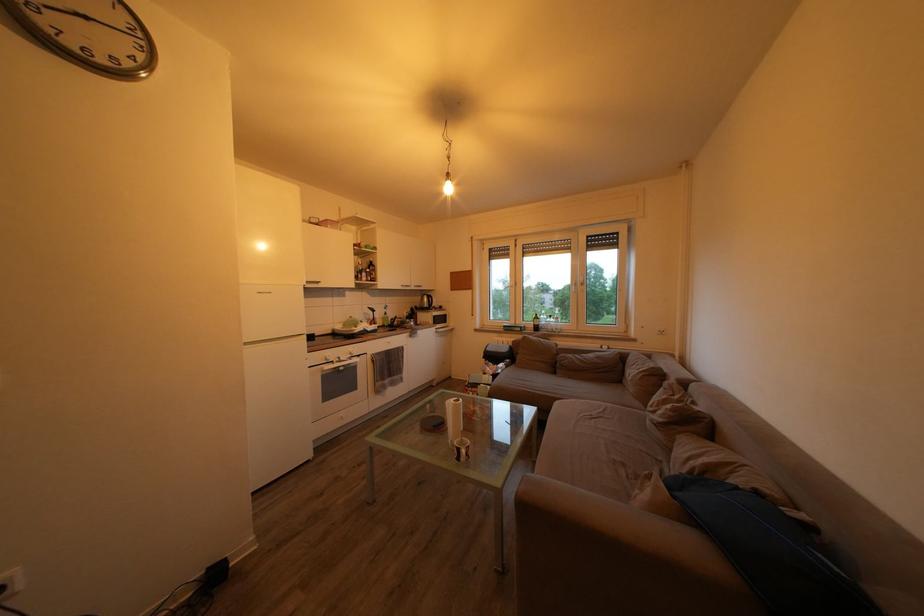
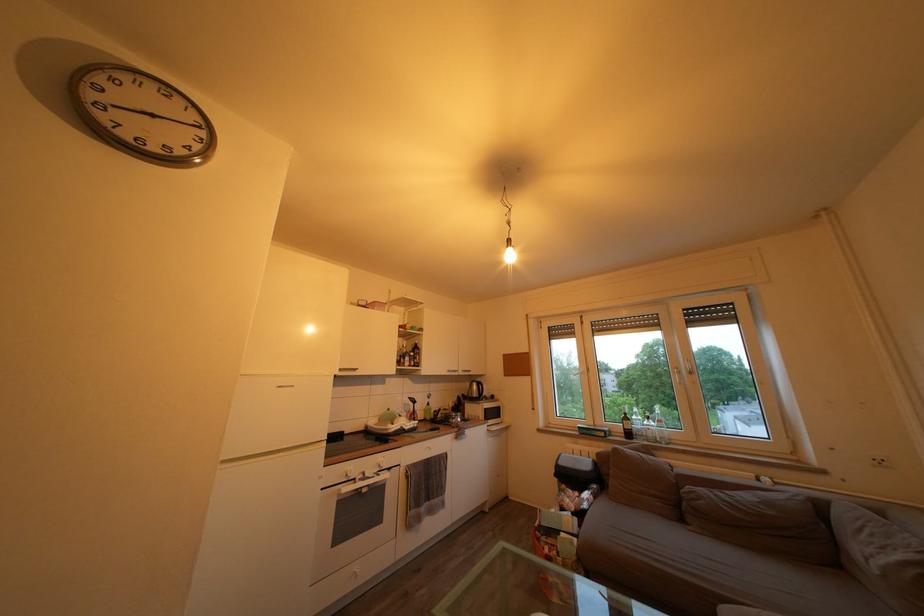
Question: I am providing you with two images of the same scene from different viewpoints. After the viewpoint changes to image2, which objects are now occluded?

Choices:
 (A) wall power outlet
 (B) round wall clock
 (C) clear glass bottle
 (D) none of these

Answer: (D)